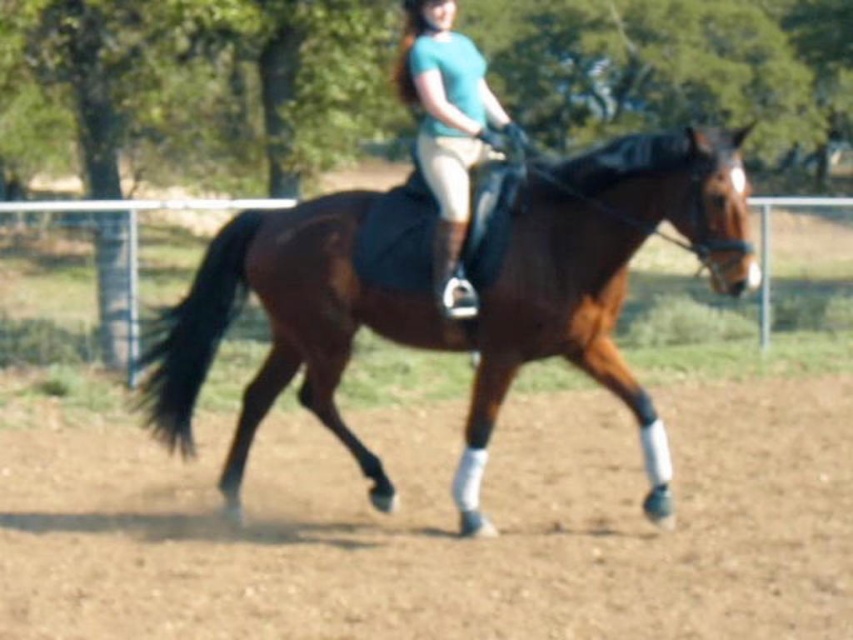
Does brown dirt field at center appear on the left side of matte teal shirt at center?

Indeed, brown dirt field at center is positioned on the left side of matte teal shirt at center.

The image size is (853, 640). Identify the location of brown dirt field at center. (444, 525).

Does point (759, 380) come farther from viewer compared to point (474, 141)?

Yes, it is.

You are a GUI agent. You are given a task and a screenshot of the screen. Output one action in this format:
    pyautogui.click(x=<x>, y=<y>)
    Task: Click on the brown dirt field at center
    
    Given the screenshot: What is the action you would take?
    pyautogui.click(x=444, y=525)

This screenshot has width=853, height=640. Identify the location of brown glossy horse at center. (431, 296).

Which of these two, brown glossy horse at center or matte teal shirt at center, stands shorter?

matte teal shirt at center

The width and height of the screenshot is (853, 640). I want to click on brown glossy horse at center, so click(431, 296).

Looking at this image, can you confirm if brown dirt field at center is shorter than brown glossy horse at center?

Yes, brown dirt field at center is shorter than brown glossy horse at center.

This screenshot has width=853, height=640. Describe the element at coordinates (444, 525) in the screenshot. I see `brown dirt field at center` at that location.

The height and width of the screenshot is (640, 853). In order to click on brown dirt field at center in this screenshot , I will do `click(444, 525)`.